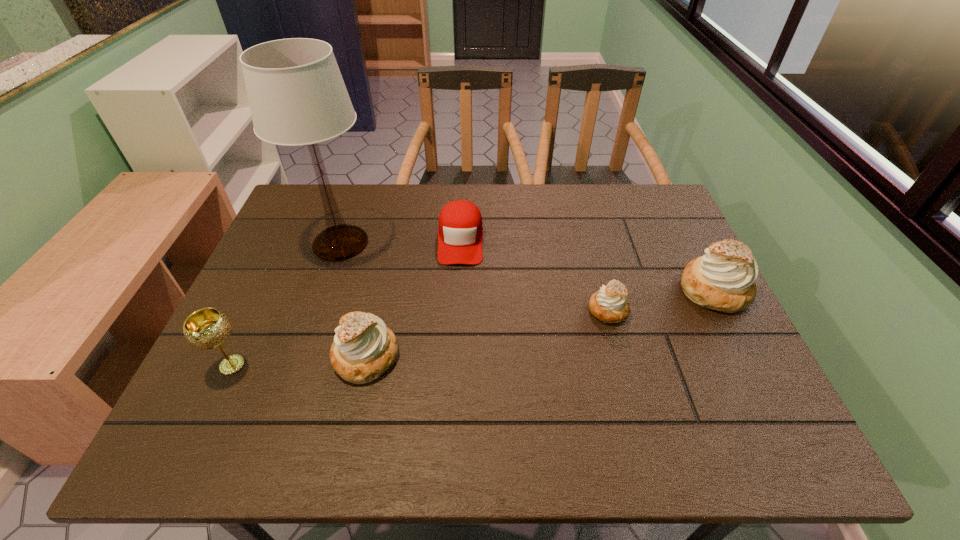
Locate which pastry ranks second in proximity to the tallest object. Please provide its 2D coordinates. Your answer should be formatted as a tuple, i.e. [(x, y)], where the tuple contains the x and y coordinates of a point satisfying the conditions above.

[(609, 305)]

At what (x,y) coordinates should I click in order to perform the action: click on the closest pastry to the shortest pastry. Please return your answer as a coordinate pair (x, y). The width and height of the screenshot is (960, 540). Looking at the image, I should click on (723, 279).

Where is `vacant area in the image that satisfies the following two spatial constraints: 1. on the front-facing side of the shortest pastry; 2. on the right side of the third object from right to left`? vacant area in the image that satisfies the following two spatial constraints: 1. on the front-facing side of the shortest pastry; 2. on the right side of the third object from right to left is located at coordinates (457, 310).

This screenshot has width=960, height=540. Find the location of `free space that satisfies the following two spatial constraints: 1. above the cylindrical shade of the tallest object; 2. on the left side of the rightmost object`. free space that satisfies the following two spatial constraints: 1. above the cylindrical shade of the tallest object; 2. on the left side of the rightmost object is located at coordinates (324, 290).

I want to click on vacant space that satisfies the following two spatial constraints: 1. on the front-facing side of the baseball cap; 2. on the left side of the rightmost pastry, so click(x=458, y=290).

At what (x,y) coordinates should I click in order to perform the action: click on free space that satisfies the following two spatial constraints: 1. above the cylindrical shade of the tallest object; 2. on the left side of the rightmost object. Please return your answer as a coordinate pair (x, y). This screenshot has height=540, width=960. Looking at the image, I should click on (324, 290).

At what (x,y) coordinates should I click in order to perform the action: click on vacant space that satisfies the following two spatial constraints: 1. on the front-facing side of the fourth object from left to right; 2. on the left side of the second pastry from left to right. Please return your answer as a coordinate pair (x, y). Image resolution: width=960 pixels, height=540 pixels. Looking at the image, I should click on (457, 310).